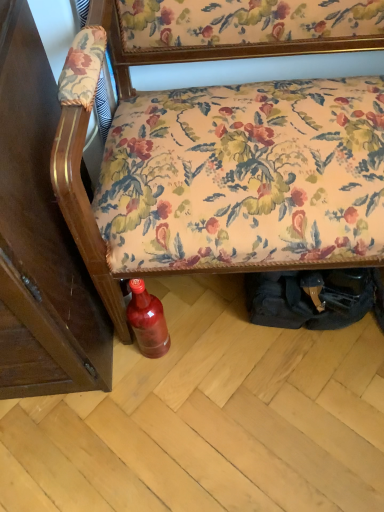
Where is `floral fabric sofa at center`? floral fabric sofa at center is located at coordinates (84, 213).

What do you see at coordinates (84, 213) in the screenshot?
I see `floral fabric sofa at center` at bounding box center [84, 213].

Image resolution: width=384 pixels, height=512 pixels. Find the location of `floral fabric sofa at center`. floral fabric sofa at center is located at coordinates 84,213.